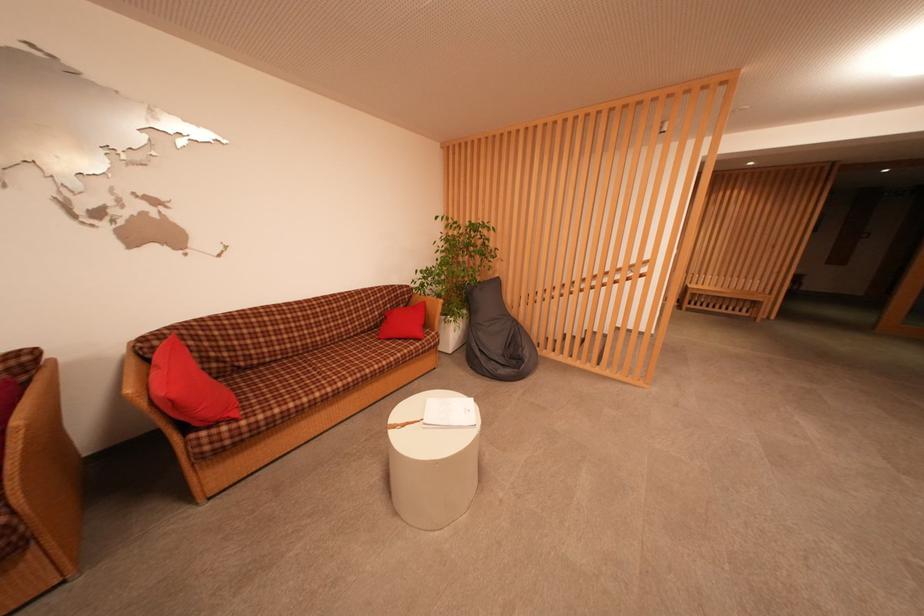
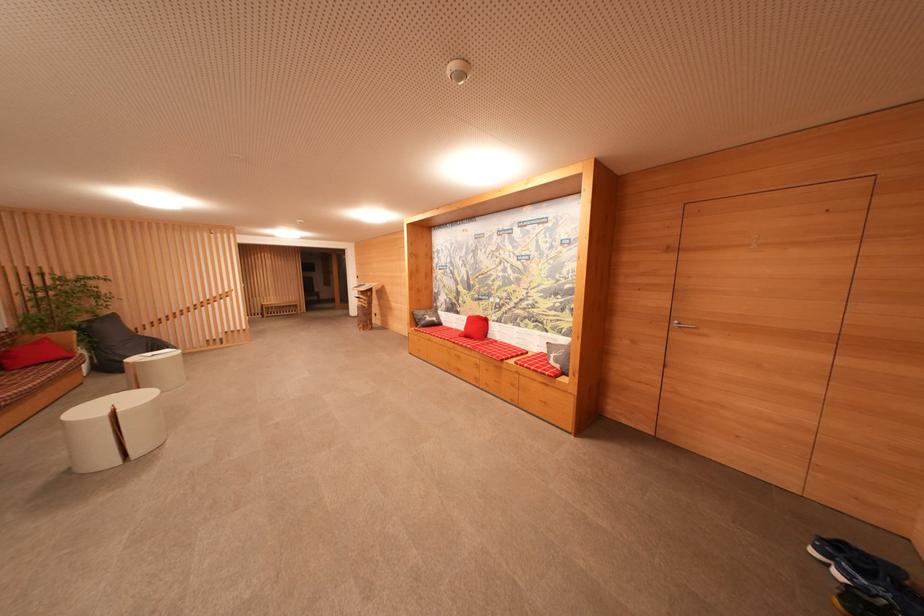
The point at (428, 306) is marked in the first image. Where is the corresponding point in the second image?

(50, 342)